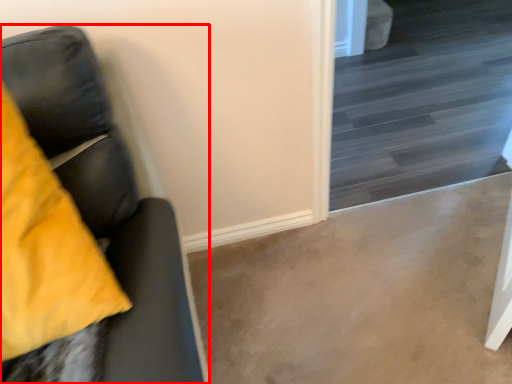
Question: Where is furniture (annotated by the red box) located in relation to stairwell in the image?

Choices:
 (A) right
 (B) left

Answer: (B)